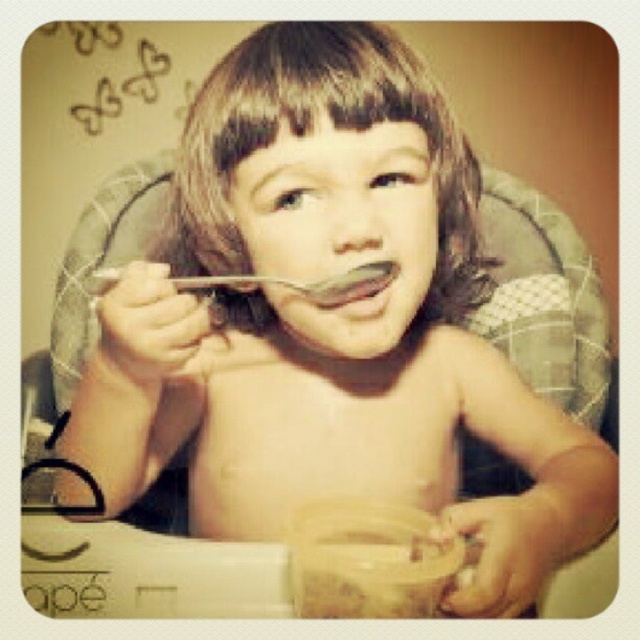
Question: Does metallic silver spoon at mouth have a smaller size compared to matte silver spoon at mouth?

Choices:
 (A) no
 (B) yes

Answer: (A)

Question: Considering the real-world distances, which object is closest to the metallic silver spoon at mouth?

Choices:
 (A) translucent plastic jar at lower center
 (B) matte silver spoon at mouth

Answer: (B)

Question: Which point is farther to the camera?

Choices:
 (A) metallic silver spoon at mouth
 (B) translucent plastic jar at lower center

Answer: (A)

Question: Which point is farther to the camera?

Choices:
 (A) (349, 593)
 (B) (324, 284)

Answer: (B)

Question: Can you confirm if metallic silver spoon at mouth is wider than matte silver spoon at mouth?

Choices:
 (A) yes
 (B) no

Answer: (A)

Question: In this image, where is metallic silver spoon at mouth located relative to matte silver spoon at mouth?

Choices:
 (A) above
 (B) below

Answer: (A)